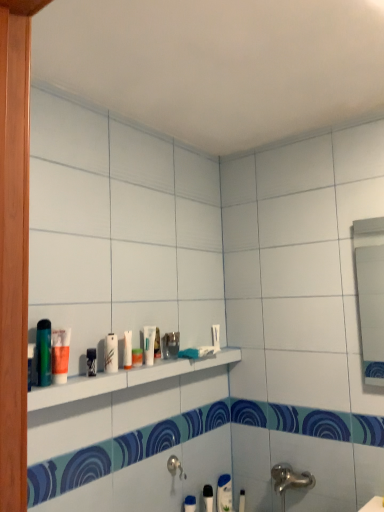
How much space does white matte toothpaste at lower right, acting as the first toothpaste starting from the back, occupy vertically?

It is 8.30 inches.

Locate an element on the screen. metallic glass at center, which appears as the third toiletry when viewed from the back is located at coordinates (172, 344).

This screenshot has height=512, width=384. Describe the element at coordinates (172, 344) in the screenshot. I see `metallic glass at center, which appears as the third toiletry when viewed from the back` at that location.

Locate an element on the screen. white glossy tube at center, acting as the fourth toiletry starting from the bottom is located at coordinates (149, 344).

Image resolution: width=384 pixels, height=512 pixels. What do you see at coordinates (91, 362) in the screenshot?
I see `black plastic razor at center, which is the 6th toiletry from right to left` at bounding box center [91, 362].

In order to face black plastic toothbrush at lower center, acting as the sixth toiletry starting from the top, should I rotate leftwards or rightwards?

You should rotate right by 2.468 degrees.

At what (x,y) coordinates should I click in order to perform the action: click on white matte toothpaste at lower right, the first toothpaste viewed from the right. Please return your answer as a coordinate pair (x, y). This screenshot has width=384, height=512. Looking at the image, I should click on (224, 493).

Which point is more distant from viewer, (146, 336) or (166, 345)?

The point (166, 345) is farther from the camera.

Who is smaller, white glossy tube at center, acting as the fourth toiletry starting from the bottom, or metallic glass at center, the fifth toiletry in the front-to-back sequence?

With smaller size is white glossy tube at center, acting as the fourth toiletry starting from the bottom.

Is white glossy tube at center, which is the fourth toiletry from left to right, beside metallic glass at center, the fifth toiletry positioned from the left?

No, white glossy tube at center, which is the fourth toiletry from left to right, is not beside metallic glass at center, the fifth toiletry positioned from the left.

From the image's perspective, is white glossy tube at center, which is the fourth toiletry from left to right, positioned above or below metallic glass at center, arranged as the third toiletry when viewed from the right?

white glossy tube at center, which is the fourth toiletry from left to right, is above metallic glass at center, arranged as the third toiletry when viewed from the right.

Does metallic glass at center, positioned as the 3th toiletry in bottom-to-top order, contain white glossy shelf at center?

No, metallic glass at center, positioned as the 3th toiletry in bottom-to-top order, does not contain white glossy shelf at center.

From a real-world perspective, which object rests below the other?

white glossy shelf at center is physically lower.

Can you see metallic glass at center, the fifth toiletry positioned from the left, touching white glossy shelf at center?

No, metallic glass at center, the fifth toiletry positioned from the left, is not with white glossy shelf at center.

Identify the location of toiletry that is the 4th one when counting backward from the white glossy shelf at center. The height and width of the screenshot is (512, 384). (149, 344).

Is white glossy shelf at center surrounded by white glossy tube at center, which is the fourth toiletry from left to right?

No, white glossy shelf at center is not a part of white glossy tube at center, which is the fourth toiletry from left to right.

Considering their positions, is white glossy tube at center, which is the fourth toiletry from left to right, located in front of or behind white glossy shelf at center?

white glossy tube at center, which is the fourth toiletry from left to right, is positioned farther from the viewer than white glossy shelf at center.

How many degrees apart are the facing directions of white glossy tube at center, which is the fourth toiletry from left to right, and white glossy shelf at center?

0.00072 degrees.

Is black plastic toothbrush at lower center, which is the second toiletry in back-to-front order, directly adjacent to white matte toothpaste at center, which appears as the 2th toothpaste when ordered from the bottom?

No, black plastic toothbrush at lower center, which is the second toiletry in back-to-front order, is not with white matte toothpaste at center, which appears as the 2th toothpaste when ordered from the bottom.

Do you think black plastic toothbrush at lower center, the 2th toiletry positioned from the right, is within white matte toothpaste at center, which appears as the 2th toothpaste when ordered from the bottom, or outside of it?

The correct answer is: outside.

Can you confirm if black plastic toothbrush at lower center, the 2th toiletry positioned from the right, is positioned to the left of white matte toothpaste at center, which appears as the 2th toothpaste when ordered from the bottom?

In fact, black plastic toothbrush at lower center, the 2th toiletry positioned from the right, is to the right of white matte toothpaste at center, which appears as the 2th toothpaste when ordered from the bottom.

Which of these two, black plastic toothbrush at lower center, the 2th toiletry in the bottom-to-top sequence, or white matte toothpaste at center, the 2th toothpaste in the right-to-left sequence, stands taller?

black plastic toothbrush at lower center, the 2th toiletry in the bottom-to-top sequence.

Is white matte toothpaste at center, acting as the 1th toothpaste starting from the front, in contact with white glossy shelf at center?

There is a gap between white matte toothpaste at center, acting as the 1th toothpaste starting from the front, and white glossy shelf at center.

Based on the photo, what's the angular difference between white matte toothpaste at center, the 2th toothpaste in the right-to-left sequence, and white glossy shelf at center's facing directions?

The angular difference between white matte toothpaste at center, the 2th toothpaste in the right-to-left sequence, and white glossy shelf at center is 0.000691 degrees.

Identify the location of shelf on the right of white matte toothpaste at center, acting as the 1th toothpaste starting from the front. The width and height of the screenshot is (384, 512). (124, 379).

Considering the sizes of white matte toothpaste at center, acting as the 1th toothpaste starting from the front, and white glossy shelf at center in the image, is white matte toothpaste at center, acting as the 1th toothpaste starting from the front, taller or shorter than white glossy shelf at center?

Clearly, white matte toothpaste at center, acting as the 1th toothpaste starting from the front, is taller compared to white glossy shelf at center.

Is white glossy shelf at center inside the boundaries of white matte tube at lower center, acting as the first toiletry starting from the right, or outside?

white glossy shelf at center is located beyond the bounds of white matte tube at lower center, acting as the first toiletry starting from the right.

Does white glossy shelf at center appear on the right side of white matte tube at lower center, positioned as the 7th toiletry in top-to-bottom order?

In fact, white glossy shelf at center is to the left of white matte tube at lower center, positioned as the 7th toiletry in top-to-bottom order.

Does white glossy shelf at center touch white matte tube at lower center, acting as the first toiletry starting from the right?

They are not placed beside each other.

Does white glossy shelf at center turn towards white matte tube at lower center, the first toiletry ordered from the bottom?

No.

From a real-world perspective, is white glossy tube at center, acting as the fourth toiletry starting from the right, beneath white matte toothpaste at center, the 2th toothpaste in the right-to-left sequence?

Yes, from a real-world perspective, white glossy tube at center, acting as the fourth toiletry starting from the right, is under white matte toothpaste at center, the 2th toothpaste in the right-to-left sequence.

Is white glossy tube at center, the 4th toiletry viewed from the front, touching white matte toothpaste at center, positioned as the 1th toothpaste in top-to-bottom order?

No, white glossy tube at center, the 4th toiletry viewed from the front, is not in contact with white matte toothpaste at center, positioned as the 1th toothpaste in top-to-bottom order.

Can you confirm if white glossy tube at center, the 4th toiletry from the top, is positioned to the right of white matte toothpaste at center, acting as the 1th toothpaste starting from the front?

Indeed, white glossy tube at center, the 4th toiletry from the top, is positioned on the right side of white matte toothpaste at center, acting as the 1th toothpaste starting from the front.

Locate an element on the screen. the 1st toiletry behind the white glossy tube at center, acting as the fourth toiletry starting from the bottom, counting from the anchor's position is located at coordinates (172, 344).

At what (x,y) coordinates should I click in order to perform the action: click on the 1st toiletry counting from the right of the white glossy shelf at center. Please return your answer as a coordinate pair (x, y). Image resolution: width=384 pixels, height=512 pixels. Looking at the image, I should click on (172, 344).

Considering their positions, is translucent plastic cup at shelf left, the seventh toiletry positioned from the right, positioned closer to white matte toothpaste at lower right, acting as the first toothpaste starting from the back, than white matte toothpaste at center, the 2th toothpaste in the right-to-left sequence?

white matte toothpaste at center, the 2th toothpaste in the right-to-left sequence, is positioned closer to the anchor white matte toothpaste at lower right, acting as the first toothpaste starting from the back.

Which object lies further to the anchor point black plastic toothbrush at lower center, acting as the sixth toiletry starting from the top, white glossy tube at center, the 4th toiletry from the top, or white glossy shelf at center?

Based on the image, white glossy tube at center, the 4th toiletry from the top, appears to be further to black plastic toothbrush at lower center, acting as the sixth toiletry starting from the top.

Considering their positions, is white matte tube at lower center, acting as the first toiletry starting from the right, positioned closer to black plastic toothbrush at lower center, which ranks as the sixth toiletry in front-to-back order, than black plastic razor at center, marked as the second toiletry in a left-to-right arrangement?

white matte tube at lower center, acting as the first toiletry starting from the right, is positioned closer to the anchor black plastic toothbrush at lower center, which ranks as the sixth toiletry in front-to-back order.

In the scene shown: Which object lies further to the anchor point metallic glass at center, positioned as the 3th toiletry in bottom-to-top order, white matte toothpaste at lower right, the first toothpaste in the bottom-to-top sequence, or white matte toothpaste at center, the 1th toothpaste from the left?

Among the two, white matte toothpaste at lower right, the first toothpaste in the bottom-to-top sequence, is located further to metallic glass at center, positioned as the 3th toiletry in bottom-to-top order.

Estimate the real-world distances between objects in this image. Which object is closer to white matte toothpaste at lower right, acting as the first toothpaste starting from the back, white matte tube at lower center, placed as the seventh toiletry when sorted from left to right, or black plastic toothbrush at lower center, which ranks as the sixth toiletry in front-to-back order?

Based on the image, black plastic toothbrush at lower center, which ranks as the sixth toiletry in front-to-back order, appears to be nearer to white matte toothpaste at lower right, acting as the first toothpaste starting from the back.

Based on their spatial positions, is white glossy shelf at center or black plastic toothbrush at lower center, the 2th toiletry positioned from the right, closer to black plastic razor at center, marked as the second toiletry in a left-to-right arrangement?

white glossy shelf at center is closer to black plastic razor at center, marked as the second toiletry in a left-to-right arrangement.

Estimate the real-world distances between objects in this image. Which object is further from white glossy tube at center, acting as the fourth toiletry starting from the bottom, white glossy shelf at center or white matte tube at lower center, placed as the 7th toiletry when sorted from front to back?

white matte tube at lower center, placed as the 7th toiletry when sorted from front to back, is further to white glossy tube at center, acting as the fourth toiletry starting from the bottom.

Considering their positions, is white matte toothpaste at center, positioned as the 1th toothpaste in top-to-bottom order, positioned closer to translucent plastic cup at shelf left, which ranks as the 1th toiletry in top-to-bottom order, than white glossy tube at center, which is the fourth toiletry from left to right?

The object closer to translucent plastic cup at shelf left, which ranks as the 1th toiletry in top-to-bottom order, is white matte toothpaste at center, positioned as the 1th toothpaste in top-to-bottom order.

Identify the location of shelf between white glossy tube at center, the 4th toiletry from the top, and white matte toothpaste at lower right, arranged as the 2th toothpaste when viewed from the top, in the vertical direction. This screenshot has height=512, width=384. (124, 379).

Where is `toothpaste between white glossy tube at center, the 5th toiletry from the right, and black plastic toothbrush at lower center, acting as the sixth toiletry starting from the top, in the vertical direction`? The image size is (384, 512). toothpaste between white glossy tube at center, the 5th toiletry from the right, and black plastic toothbrush at lower center, acting as the sixth toiletry starting from the top, in the vertical direction is located at coordinates (127, 350).

At what (x,y) coordinates should I click in order to perform the action: click on toiletry between black plastic razor at center, marked as the second toiletry in a left-to-right arrangement, and white glossy tube at center, which is the fourth toiletry from left to right, along the z-axis. Please return your answer as a coordinate pair (x, y). The width and height of the screenshot is (384, 512). Looking at the image, I should click on (111, 353).

What are the coordinates of `shelf that lies between white glossy tube at center, acting as the fourth toiletry starting from the right, and black plastic toothbrush at lower center, the sixth toiletry in the left-to-right sequence, from top to bottom` in the screenshot? It's located at (124, 379).